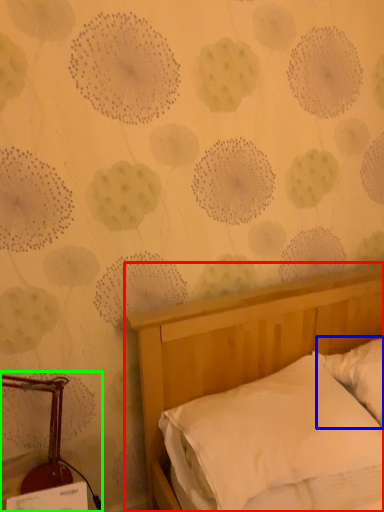
Question: Estimate the real-world distances between objects in this image. Which object is closer to bed (highlighted by a red box), pillow (highlighted by a blue box) or bedside lamp (highlighted by a green box)?

Choices:
 (A) pillow
 (B) bedside lamp

Answer: (A)